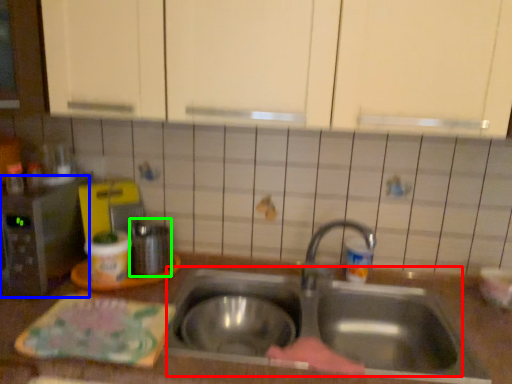
Question: Which is nearer to the sink (highlighted by a red box)? appliance (highlighted by a blue box) or appliance (highlighted by a green box).

Choices:
 (A) appliance
 (B) appliance

Answer: (B)